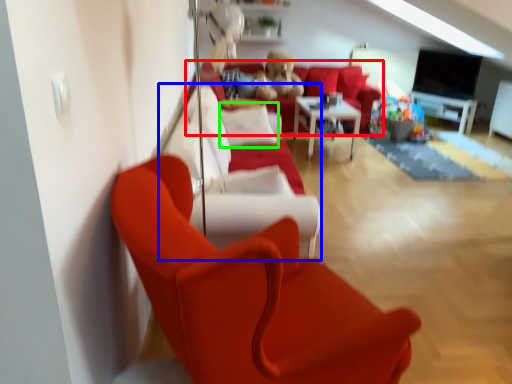
Question: Based on their relative distances, which object is nearer to studio couch (highlighted by a red box)? Choose from couch (highlighted by a blue box) and pillow (highlighted by a green box).

Choices:
 (A) couch
 (B) pillow

Answer: (B)